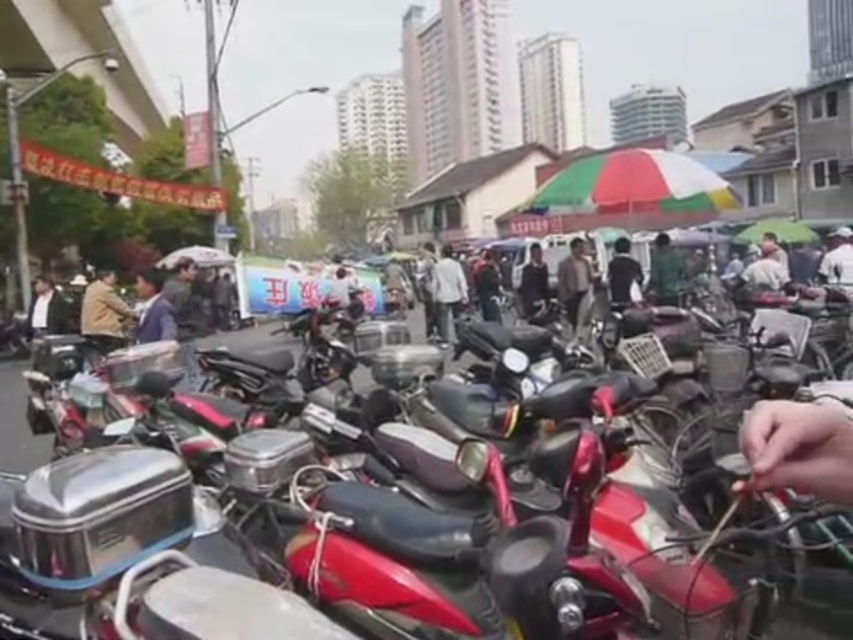
You are a fashion designer observing the jackets in the scene. Which jacket, the black matte jacket at center or the dark gray jacket at center, would you say is positioned in front of the other?

The black matte jacket at center is closer to the viewer than the dark gray jacket at center, so it is positioned in front of the dark gray jacket at center.

You are standing at the edge of the urban street scene described. There is a point marked at coordinates (622, 273). What object is located at that point?

The point at coordinates (622, 273) indicates the location of the black matte jacket at center.

You are a tailor observing a crowd in an urban street scene. You notice a white matte jacket at center and a dark gray suit at left. Which clothing item appears bigger in size?

The white matte jacket at center is larger in size than the dark gray suit at left.